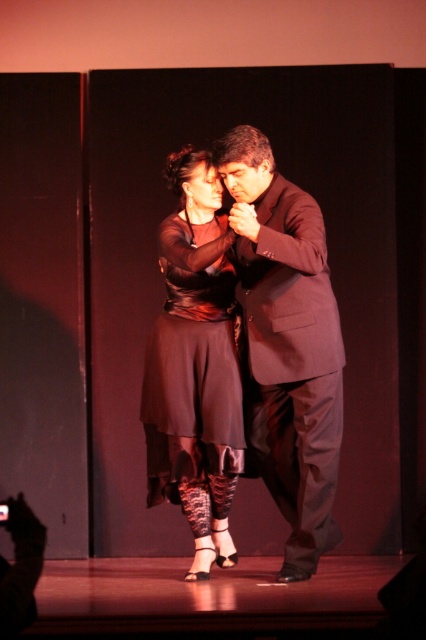
Question: Can you confirm if dark brown suit at center is positioned to the left of black satin dress at center?

Choices:
 (A) yes
 (B) no

Answer: (B)

Question: Which of the following is the farthest from the observer?

Choices:
 (A) black satin dress at center
 (B) dark brown suit at center

Answer: (A)

Question: Does dark brown suit at center come in front of black satin dress at center?

Choices:
 (A) no
 (B) yes

Answer: (B)

Question: Does dark brown suit at center appear under black satin dress at center?

Choices:
 (A) no
 (B) yes

Answer: (A)

Question: Which point is closer to the camera?

Choices:
 (A) (172, 246)
 (B) (253, 157)

Answer: (B)

Question: Which object appears closest to the camera in this image?

Choices:
 (A) black satin dress at center
 (B) dark brown suit at center

Answer: (B)